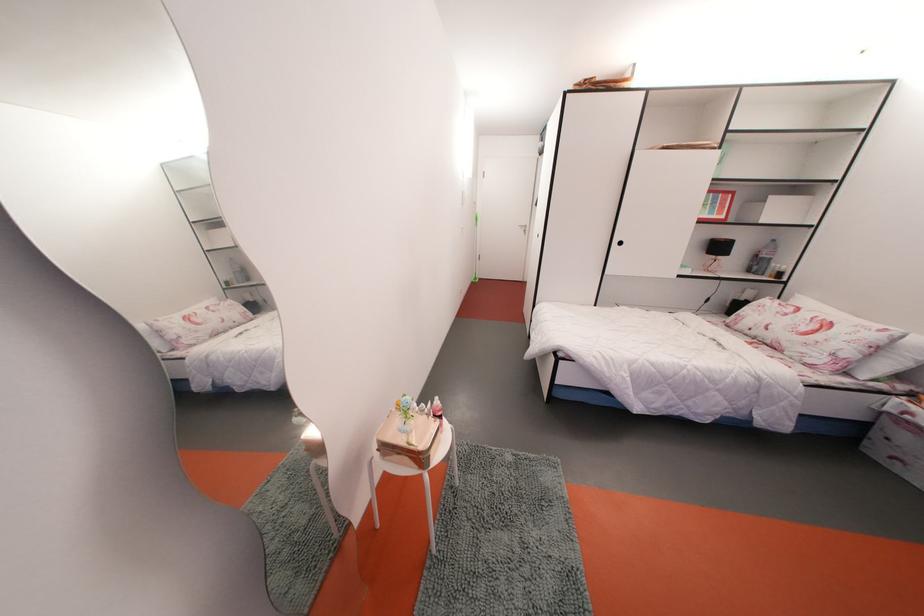
The width and height of the screenshot is (924, 616). What do you see at coordinates (524, 229) in the screenshot?
I see `the door handle` at bounding box center [524, 229].